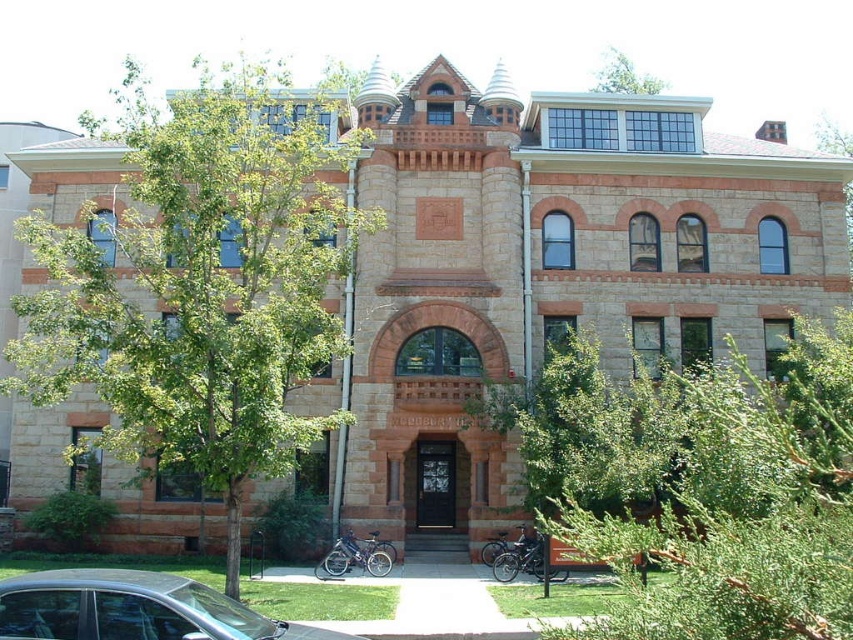
You are a gardener planning to place a new bench between the green leafy tree at left and the green leafy tree at upper center. Considering their widths, which tree should the bench be closer to for better balance?

The bench should be closer to the green leafy tree at upper center because the green leafy tree at left is wider, so placing the bench closer to the narrower tree would help balance the visual weight between them.

You are standing at the entrance of the building and want to park your car. Given the silver metallic car at lower left and the green leafy tree at upper center, which one is closer to the entrance?

The silver metallic car at lower left is closer to the entrance because it is located below the green leafy tree at upper center, indicating it is positioned lower in the scene and thus nearer to the entrance area.